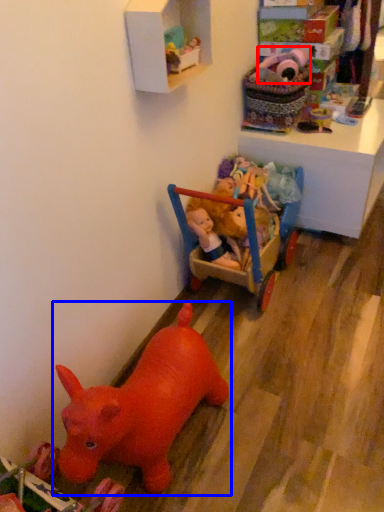
Question: Which point is closer to the camera, toy (highlighted by a red box) or toy (highlighted by a blue box)?

Choices:
 (A) toy
 (B) toy

Answer: (B)